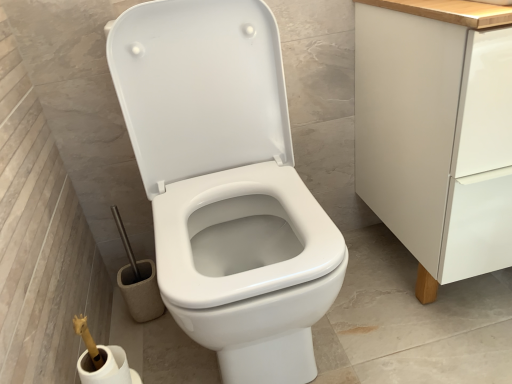
This screenshot has height=384, width=512. Find the location of `unoccupied region to the right of white glossy toilet at center`. unoccupied region to the right of white glossy toilet at center is located at coordinates (385, 324).